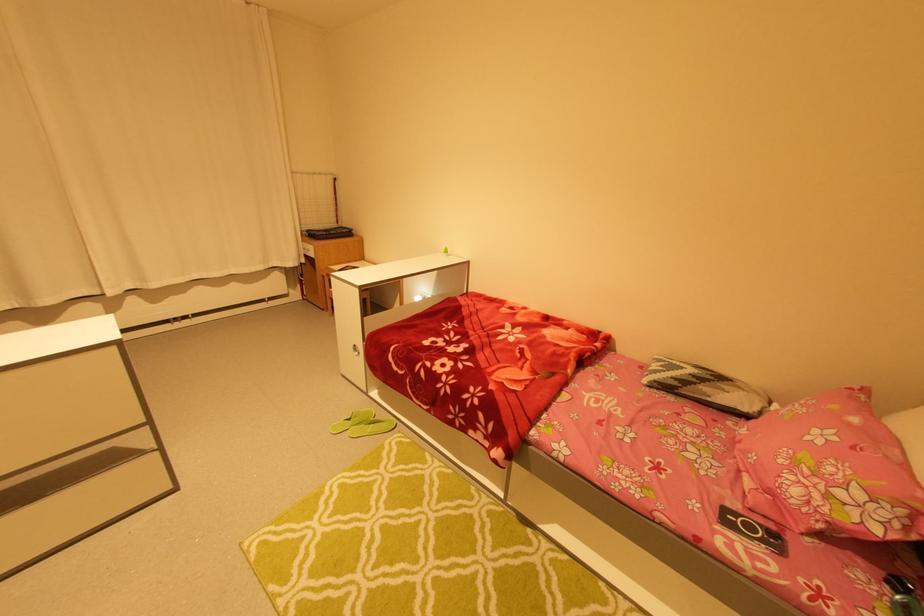
Identify the location of recessed drawer handle. (359, 351).